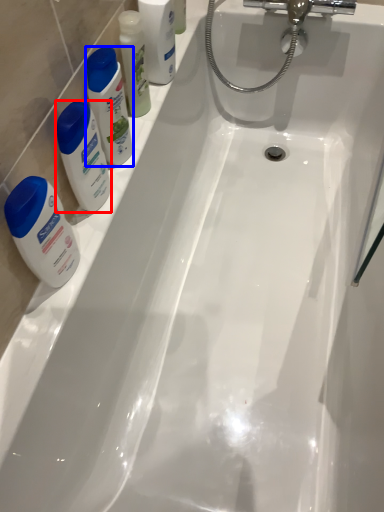
Question: Among these objects, which one is farthest to the camera, cleaning product (highlighted by a red box) or cleaning product (highlighted by a blue box)?

Choices:
 (A) cleaning product
 (B) cleaning product

Answer: (B)